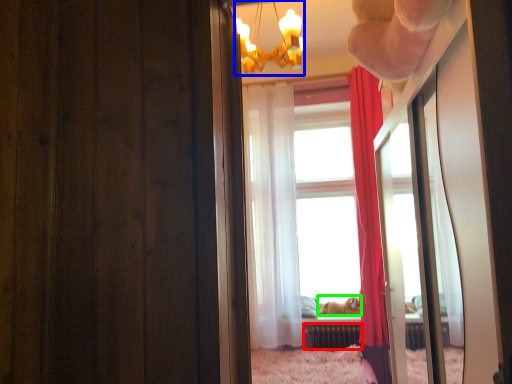
Question: Which object is positioned farthest from radiator (highlighted by a red box)? Select from lamp (highlighted by a blue box) and animal (highlighted by a green box).

Choices:
 (A) lamp
 (B) animal

Answer: (A)